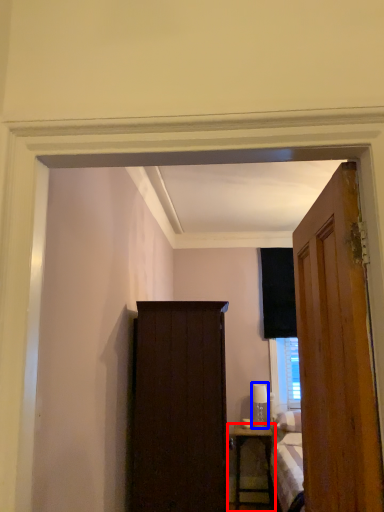
Question: Which object is further to the camera taking this photo, nightstand (highlighted by a red box) or lamp (highlighted by a blue box)?

Choices:
 (A) nightstand
 (B) lamp

Answer: (B)